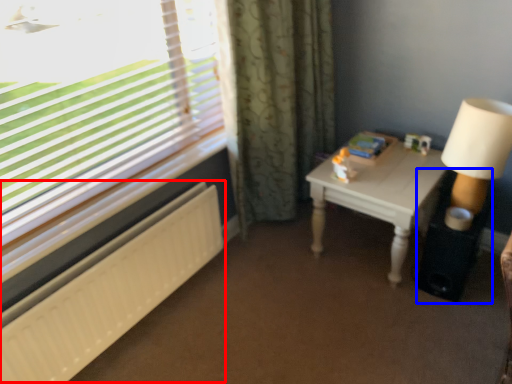
Question: Which object is further to the camera taking this photo, radiator (highlighted by a red box) or side table (highlighted by a blue box)?

Choices:
 (A) radiator
 (B) side table

Answer: (B)